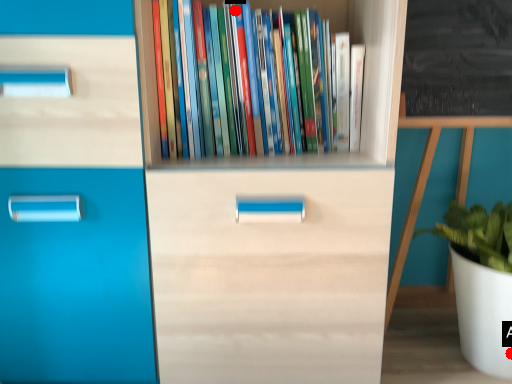
Question: Two points are circled on the image, labeled by A and B beside each circle. Among these points, which one is nearest to the camera?

Choices:
 (A) A is closer
 (B) B is closer

Answer: (B)